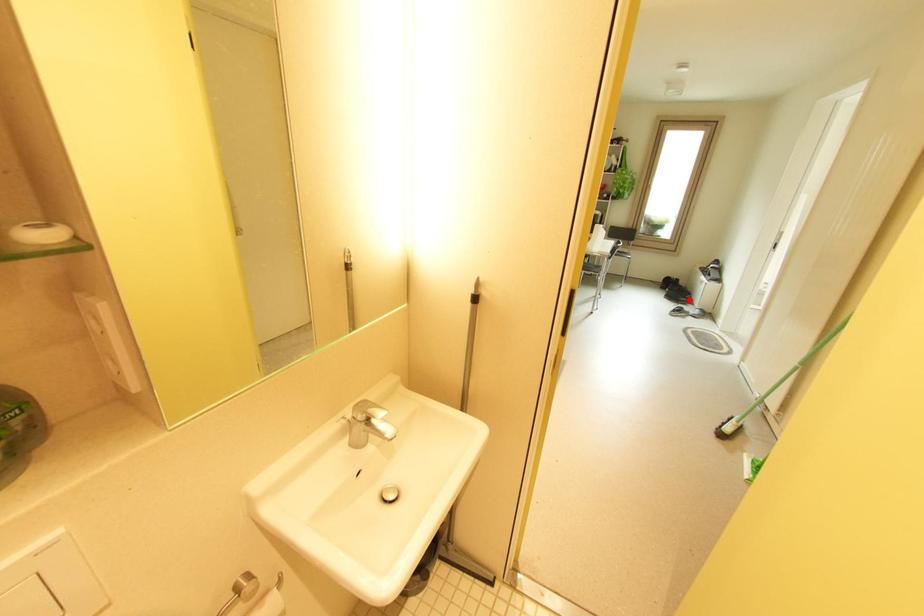
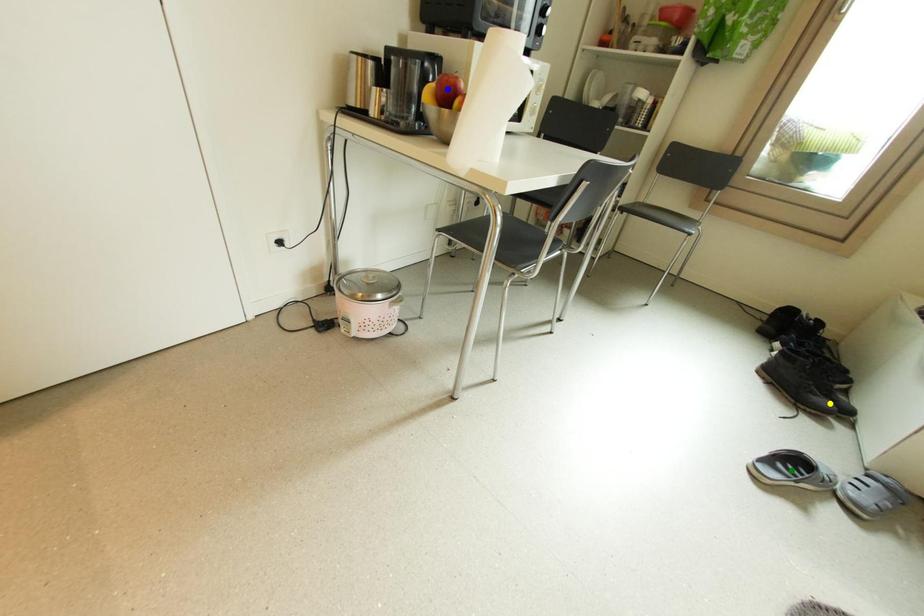
Question: I am providing you with two images of the same scene from different viewpoints. A red point is marked on the first image. You are given multiple points on the second image. Which mark in image 2 goes with the point in image 1?

Choices:
 (A) yellow point
 (B) green point
 (C) blue point

Answer: (A)